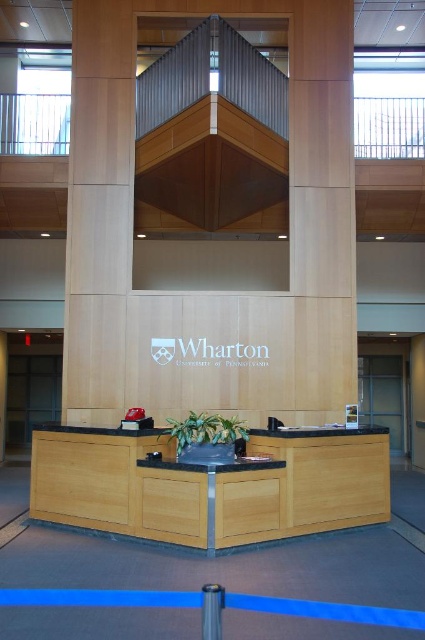
You are standing in the reception area of Wharton School and want to take a photo of the point at coordinates (64, 513). The camera you have can only focus on objects within 20 feet. Can you capture a clear photo of that point?

The distance of point (64, 513) from the camera is 21.05 feet, which is beyond the camera focus range of 20 feet. Therefore, you cannot capture a clear photo of that point.